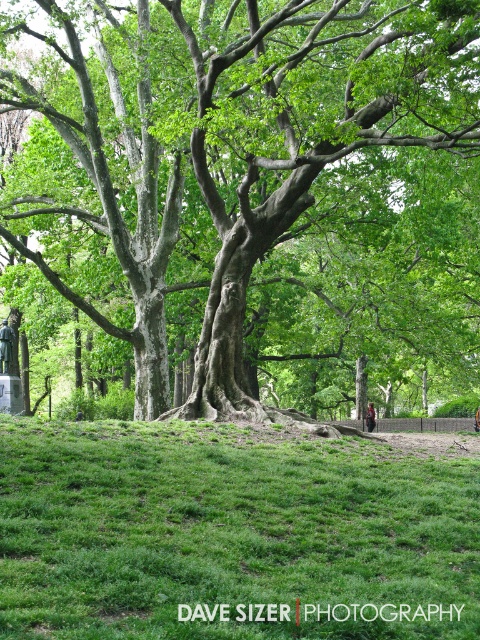
Which is below, green rough bark tree at center or brown leather backpack at lower right?

brown leather backpack at lower right is lower down.

Is green rough bark tree at center bigger than brown leather backpack at lower right?

Yes, green rough bark tree at center is bigger than brown leather backpack at lower right.

The height and width of the screenshot is (640, 480). I want to click on green rough bark tree at center, so pos(251,189).

Can you confirm if green rough bark tree at center is shorter than green grassy hill at lower center?

No, green rough bark tree at center is not shorter than green grassy hill at lower center.

At what (x,y) coordinates should I click in order to perform the action: click on green rough bark tree at center. Please return your answer as a coordinate pair (x, y). Looking at the image, I should click on (251, 189).

Measure the distance between green grassy hill at lower center and brown leather backpack at lower right.

They are 37.24 meters apart.

Which is more to the right, green grassy hill at lower center or brown leather backpack at lower right?

brown leather backpack at lower right is more to the right.

The image size is (480, 640). Find the location of `green grassy hill at lower center`. green grassy hill at lower center is located at coordinates (230, 536).

You are a GUI agent. You are given a task and a screenshot of the screen. Output one action in this format:
    pyautogui.click(x=<x>, y=<y>)
    Task: Click on the green grassy hill at lower center
    Image resolution: width=480 pixels, height=640 pixels.
    Given the screenshot: What is the action you would take?
    pyautogui.click(x=230, y=536)